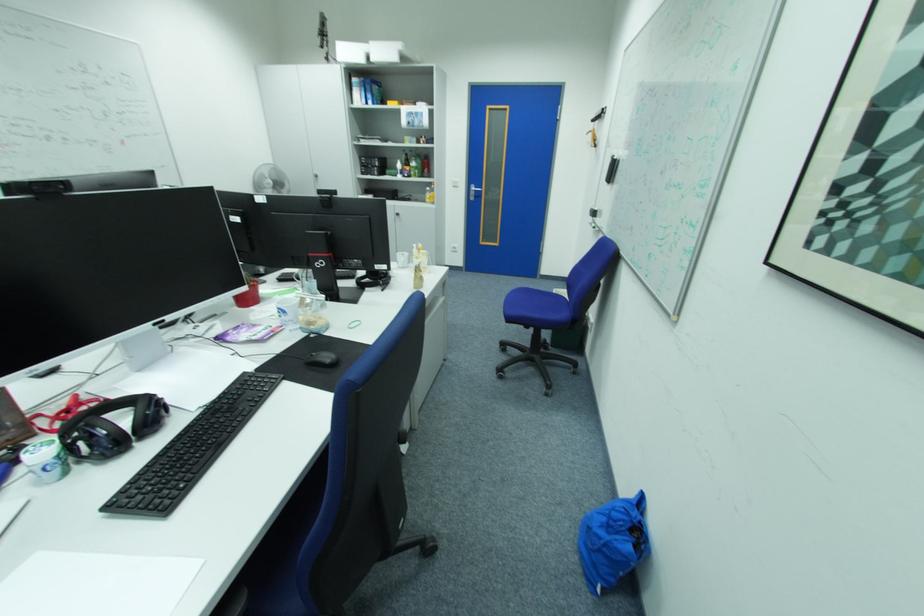
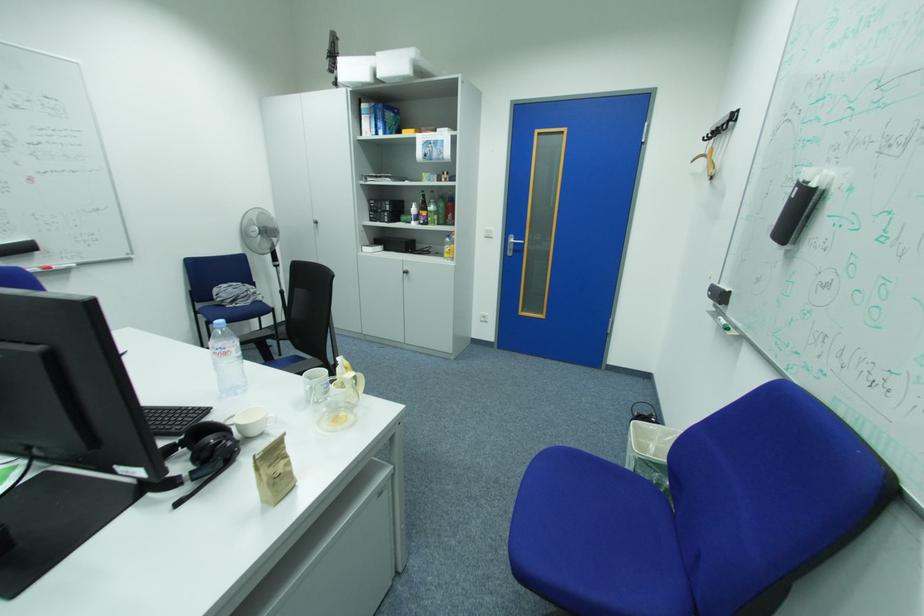
The point at (393,283) is marked in the first image. Where is the corresponding point in the second image?

(203, 476)